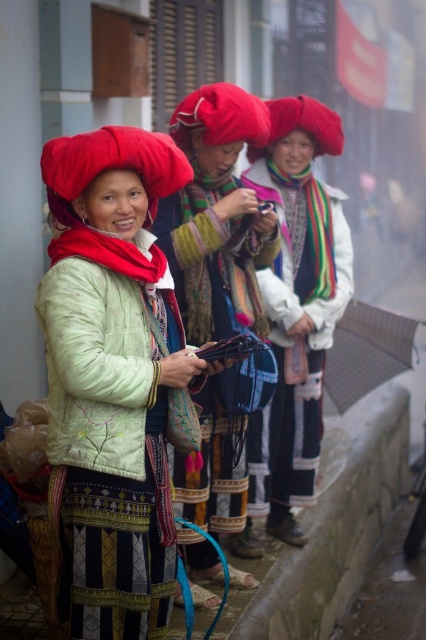
You are a photographer standing at the edge of the narrow street. You want to take a photo of the matte green jacket at center and the concrete curb at lower right. Which object should you focus on first if you want to capture both in the frame without moving the camera?

The matte green jacket at center is much taller than the concrete curb at lower right, so you should focus on the matte green jacket at center first to ensure it is in focus before the curb.

You are an observer standing in front of the group. Which object is closer to you between the matte red hat at center and the textured fabric scarf at center?

The matte red hat at center is closer to you because the textured fabric scarf at center is behind it.